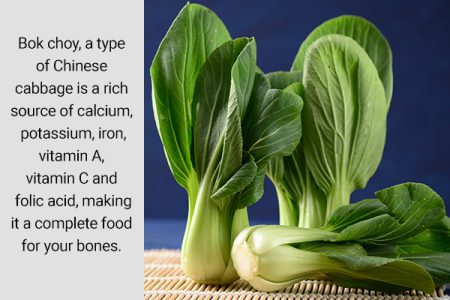
The image size is (450, 300). Identify the location of bamboo mat. (178, 285).